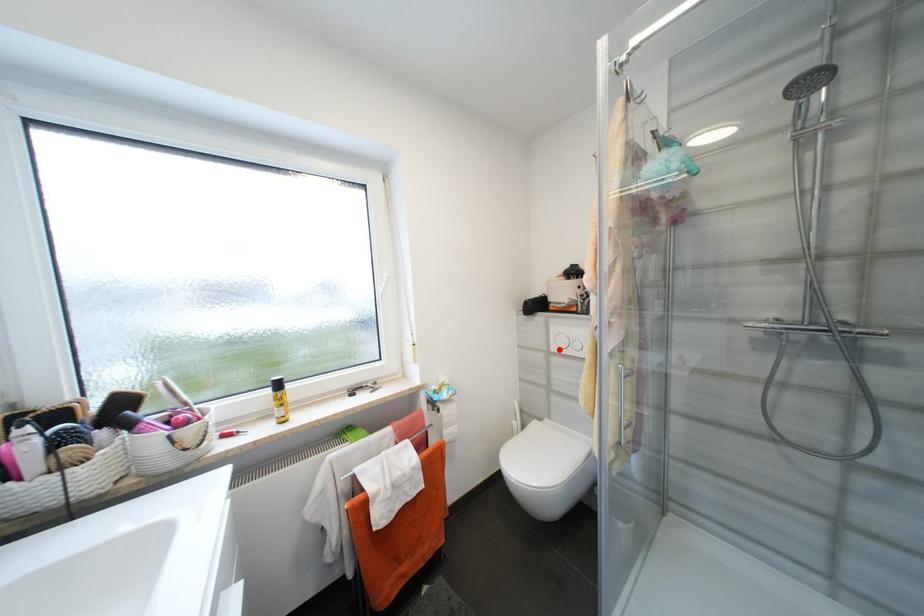
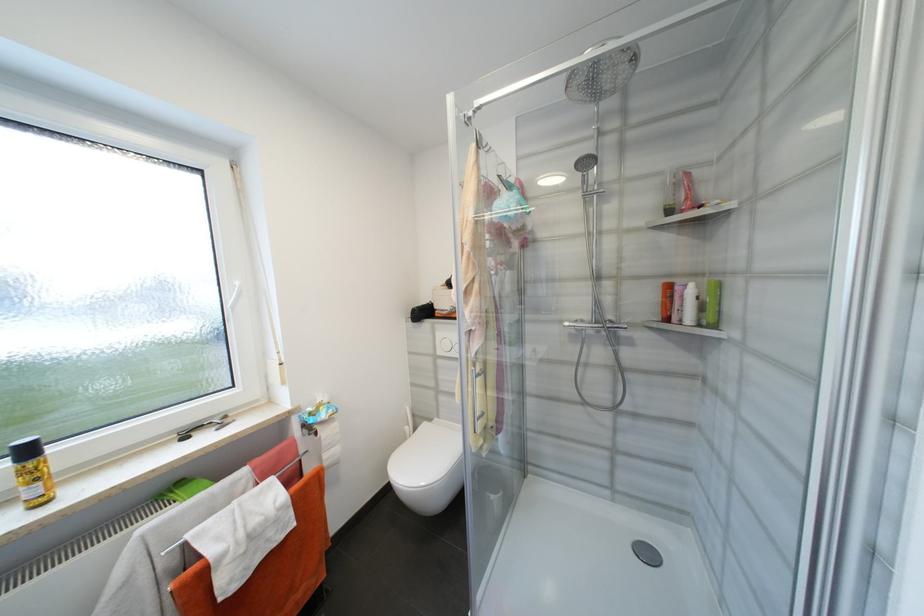
Question: A red point is marked in image1. In image2, is the corresponding 3D point closer to the camera or farther? Reply with the corresponding letter.

Choices:
 (A) The corresponding 3D point is closer.
 (B) The corresponding 3D point is farther.

Answer: (B)